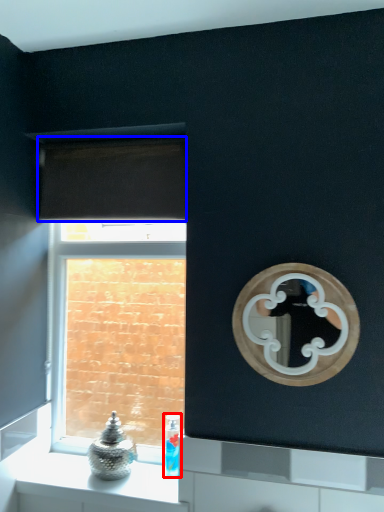
Question: Among these objects, which one is farthest to the camera, toiletry (highlighted by a red box) or curtain (highlighted by a blue box)?

Choices:
 (A) toiletry
 (B) curtain

Answer: (A)